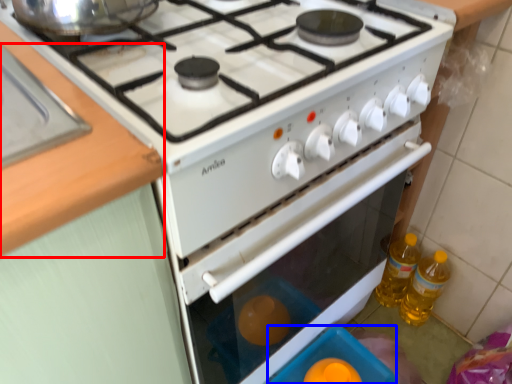
Question: Which point is further to the camera, counter top (highlighted by a red box) or appliance (highlighted by a blue box)?

Choices:
 (A) counter top
 (B) appliance

Answer: (B)